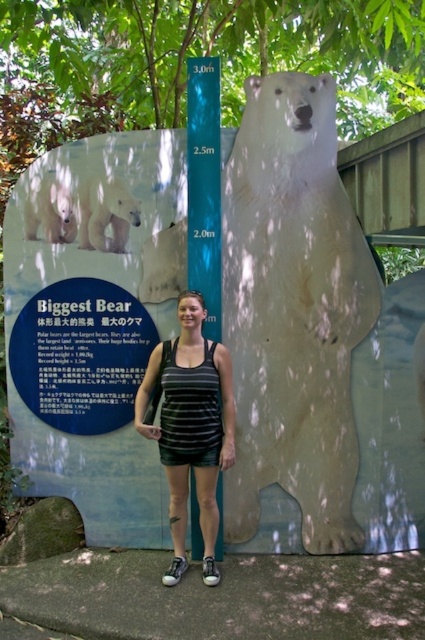
You are a photographer adjusting your camera to capture the person and the display board. You notice two points marked on the image at coordinates point (167, 406) and point (115, 205). Which point is closer to the camera?

Point (167, 406) is in front of point (115, 205), so it is closer to the camera.

You are a photographer setting up for a photo shoot. You see the translucent plastic polar bear at center and the white matte polar bear at upper left. Which polar bear should you focus on if you want to capture the one closer to the bottom of the display board?

The translucent plastic polar bear at center is below the white matte polar bear at upper left, so it is closer to the bottom of the display board. Focus on the translucent plastic polar bear at center.

Looking at this image, you are a photographer trying to capture a clear shot of the translucent plastic polar bear at center. The display board has a large cutout on the right side. Where should you position yourself relative to the board to ensure the polar bear is centered in your frame?

To center the translucent plastic polar bear at center in your frame, position yourself directly in front of the board at the point corresponding to its coordinates, which are approximately at 0.486 on the horizontal axis and 0.689 on the vertical axis. This ensures the polar bear is centered in your shot.